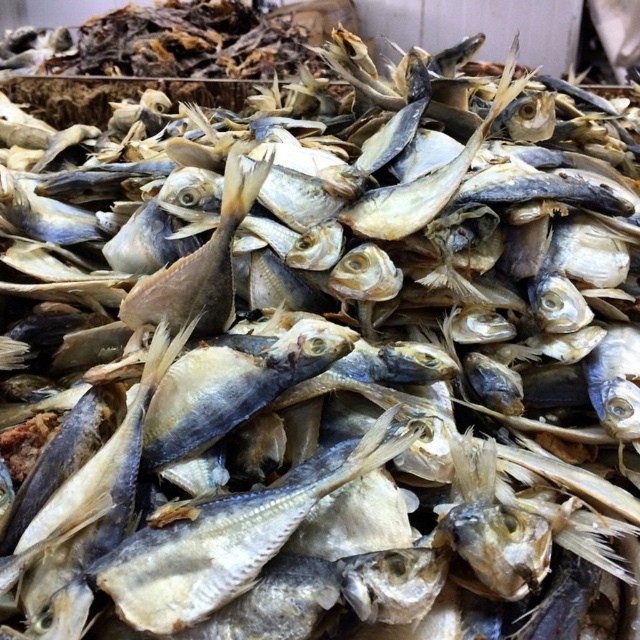
This screenshot has width=640, height=640. What do you see at coordinates (221, 544) in the screenshot?
I see `shiny silver fish at center` at bounding box center [221, 544].

Between shiny silver fish at center and light brown dried fish at center, which one is positioned higher?

light brown dried fish at center is higher up.

This screenshot has height=640, width=640. Find the location of `shiny silver fish at center`. shiny silver fish at center is located at coordinates (221, 544).

Identify the location of shiny silver fish at center. (221, 544).